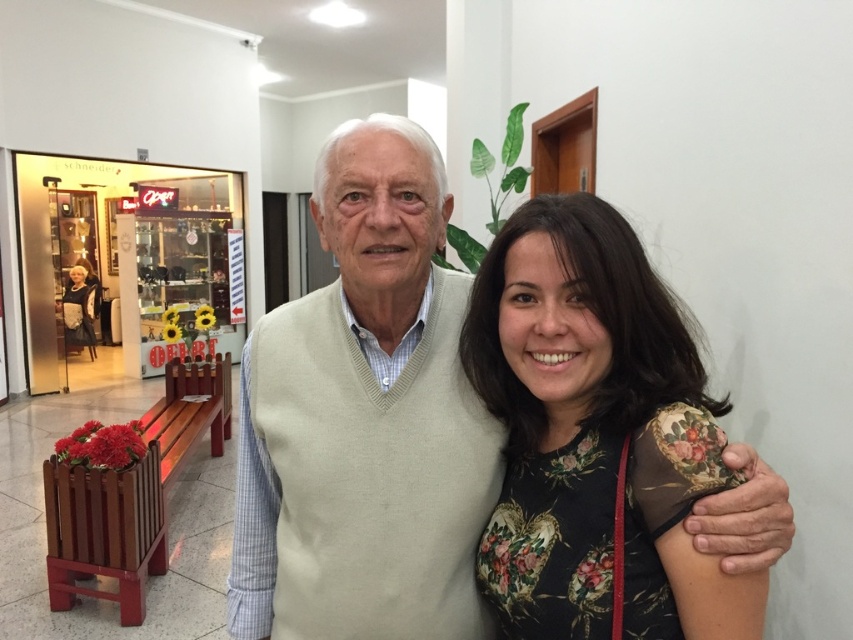
You are a photographer standing at the camera position. You want to place a small sticker exactly at point [345,163]. The sticker has a diameter of 2 inches. Will the sticker fit without overlapping any other objects in the scene?

The distance from the camera to point [345,163] is 38.38 inches. Since the sticker is only 2 inches in diameter, it will fit without overlapping other objects as long as there is enough space at that point. However, the exact placement depends on the scene layout not described here.

You are a fashion designer looking for inspiration. You see a floral fabric dress at center and a black textured coat at left. Which item is closer to the right side of the image?

The floral fabric dress at center is positioned on the right side of black textured coat at left, so it is closer to the right side of the image.

You are a photographer trying to capture the floral fabric dress at center in focus while ensuring the people in the image are also in focus. Given that your camera has a depth of field that can cover 30 inches, will you be able to achieve this?

The distance between the floral fabric dress at center and the camera is 30.26 inches. Since the depth of field can cover 30 inches, it is slightly insufficient. Therefore, you might not be able to have both the dress and the people in focus simultaneously.